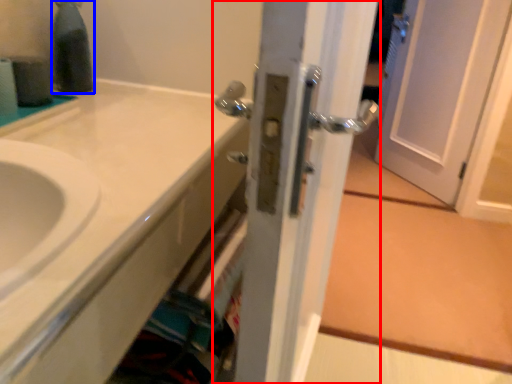
Question: Which object appears farthest to the camera in this image, door (highlighted by a red box) or bottle (highlighted by a blue box)?

Choices:
 (A) door
 (B) bottle

Answer: (B)